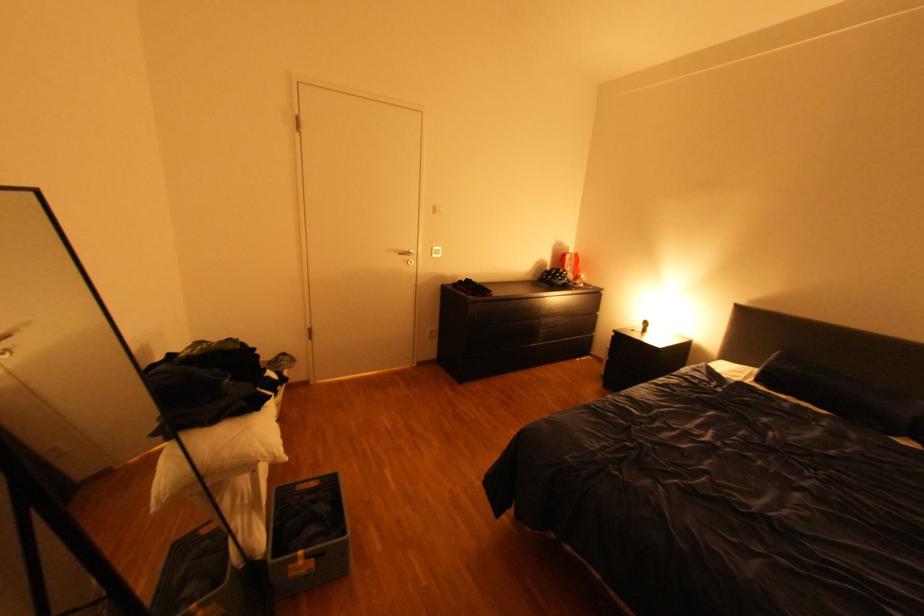
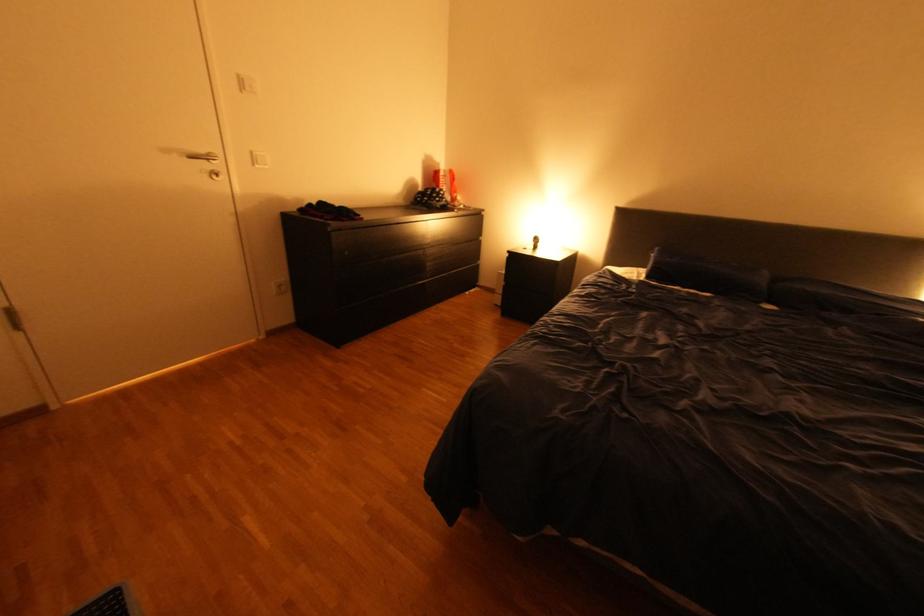
The point at (417, 249) is marked in the first image. Where is the corresponding point in the second image?

(213, 151)